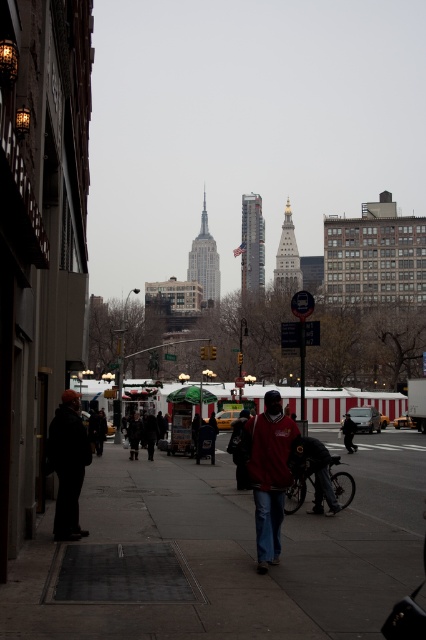
Question: Which point is farther to the camera?

Choices:
 (A) (279, 400)
 (B) (348, 417)
 (C) (417, 540)

Answer: (B)

Question: Considering the relative positions of matte red sweater at center and dark blue jeans at center in the image provided, where is matte red sweater at center located with respect to dark blue jeans at center?

Choices:
 (A) below
 (B) above

Answer: (B)

Question: Which object appears closest to the camera in this image?

Choices:
 (A) dark gray jacket at left
 (B) concrete sidewalk at center
 (C) dark blue jeans at center

Answer: (B)

Question: Can you confirm if concrete sidewalk at center is positioned above dark blue jeans at center?

Choices:
 (A) no
 (B) yes

Answer: (B)

Question: Is concrete sidewalk at center smaller than dark blue jeans at center?

Choices:
 (A) no
 (B) yes

Answer: (A)

Question: Which point is closer to the camera taking this photo?

Choices:
 (A) (66, 472)
 (B) (287, 472)
 (C) (408, 484)
 (D) (351, 449)

Answer: (B)